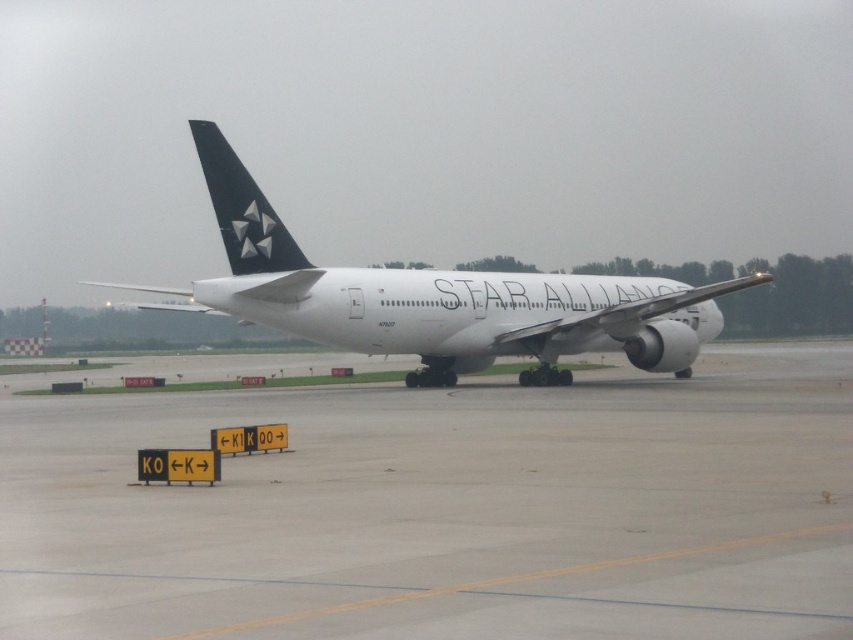
Question: Does gray concrete tarmac at center appear over white matte airplane at center?

Choices:
 (A) yes
 (B) no

Answer: (B)

Question: Does gray concrete tarmac at center appear on the left side of white matte airplane at center?

Choices:
 (A) yes
 (B) no

Answer: (B)

Question: Which point is farther to the camera?

Choices:
 (A) white matte airplane at center
 (B) gray concrete tarmac at center

Answer: (A)

Question: Which of the following is the farthest from the observer?

Choices:
 (A) gray concrete tarmac at center
 (B) white matte airplane at center

Answer: (B)

Question: Is gray concrete tarmac at center behind white matte airplane at center?

Choices:
 (A) no
 (B) yes

Answer: (A)